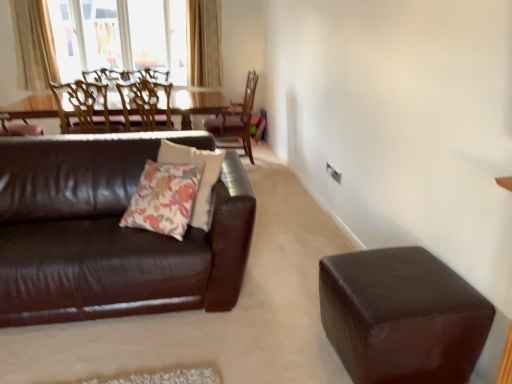
Where is `wooden chair at upper center, placed as the 2th chair when sorted from left to right`? The image size is (512, 384). wooden chair at upper center, placed as the 2th chair when sorted from left to right is located at coordinates (146, 106).

What do you see at coordinates (110, 232) in the screenshot?
I see `shiny brown leather couch at left` at bounding box center [110, 232].

Identify the location of light beige textured curtain at upper center, the 1th curtain when ordered from right to left. (204, 43).

Identify the location of wooden chair at upper left, acting as the third chair starting from the right. (82, 109).

In order to click on wooden chair at upper center, positioned as the 2th chair in right-to-left order in this screenshot , I will do `click(146, 106)`.

Does wooden chair at upper center, positioned as the 2th chair in right-to-left order, have a greater width compared to floral-patterned fabric pillow at center?

Indeed, wooden chair at upper center, positioned as the 2th chair in right-to-left order, has a greater width compared to floral-patterned fabric pillow at center.

Locate an element on the screen. The height and width of the screenshot is (384, 512). throw pillow in front of the wooden chair at upper center, placed as the 2th chair when sorted from left to right is located at coordinates (164, 198).

Which object is further away from the camera taking this photo, wooden chair at upper center, positioned as the 2th chair in right-to-left order, or floral-patterned fabric pillow at center?

wooden chair at upper center, positioned as the 2th chair in right-to-left order.

Which of these two, wooden chair at upper center, placed as the 2th chair when sorted from left to right, or floral-patterned fabric pillow at center, is bigger?

wooden chair at upper center, placed as the 2th chair when sorted from left to right.

Between wooden chair at upper left, acting as the third chair starting from the right, and wooden chair at center, the first chair when ordered from right to left, which one has more height?

With more height is wooden chair at center, the first chair when ordered from right to left.

Is there a large distance between wooden chair at upper left, acting as the third chair starting from the right, and wooden chair at center, which is the third chair in left-to-right order?

That's right, there is a large distance between wooden chair at upper left, acting as the third chair starting from the right, and wooden chair at center, which is the third chair in left-to-right order.

Which point is more distant from viewer, (82,95) or (228,128)?

The point (228,128) is behind.

Is wooden chair at upper left, the 1th chair positioned from the left, inside the boundaries of wooden chair at center, which is the third chair in left-to-right order, or outside?

The correct answer is: outside.

Can you tell me how much light beige textured curtain at upper center, the 1th curtain when ordered from right to left, and wooden chair at upper center, positioned as the 2th chair in right-to-left order, differ in facing direction?

They differ by 178 degrees in their facing directions.

Does light beige textured curtain at upper center, arranged as the second curtain when viewed from the left, have a larger size compared to wooden chair at upper center, placed as the 2th chair when sorted from left to right?

Incorrect, light beige textured curtain at upper center, arranged as the second curtain when viewed from the left, is not larger than wooden chair at upper center, placed as the 2th chair when sorted from left to right.

Considering the positions of point (215, 7) and point (160, 88), is point (215, 7) closer or farther from the camera than point (160, 88)?

Point (215, 7) appears to be farther away from the viewer than point (160, 88).

From a real-world perspective, between light beige textured curtain at upper center, arranged as the second curtain when viewed from the left, and wooden chair at upper center, positioned as the 2th chair in right-to-left order, who is vertically higher?

light beige textured curtain at upper center, arranged as the second curtain when viewed from the left, from a real-world perspective.

Is the position of beige fabric curtain at upper left, marked as the second curtain in a right-to-left arrangement, less distant than that of wooden chair at center, which is the third chair in left-to-right order?

No, it is not.

Is beige fabric curtain at upper left, the first curtain in the left-to-right sequence, inside or outside of wooden chair at center, which is the third chair in left-to-right order?

beige fabric curtain at upper left, the first curtain in the left-to-right sequence, is not enclosed by wooden chair at center, which is the third chair in left-to-right order.

Which of these two, beige fabric curtain at upper left, the first curtain in the left-to-right sequence, or wooden chair at center, which is the third chair in left-to-right order, is smaller?

beige fabric curtain at upper left, the first curtain in the left-to-right sequence.

What's the angular difference between beige fabric curtain at upper left, marked as the second curtain in a right-to-left arrangement, and wooden chair at center, the first chair when ordered from right to left,'s facing directions?

There is a 89.9-degree angle between the facing directions of beige fabric curtain at upper left, marked as the second curtain in a right-to-left arrangement, and wooden chair at center, the first chair when ordered from right to left.

From a real-world perspective, who is located lower, wooden chair at upper left, the 1th chair positioned from the left, or shiny brown leather couch at left?

shiny brown leather couch at left is physically lower.

In terms of width, does wooden chair at upper left, acting as the third chair starting from the right, look wider or thinner when compared to shiny brown leather couch at left?

In the image, wooden chair at upper left, acting as the third chair starting from the right, appears to be more narrow than shiny brown leather couch at left.

Is wooden chair at upper left, acting as the third chair starting from the right, aimed at shiny brown leather couch at left?

No, wooden chair at upper left, acting as the third chair starting from the right, is not oriented towards shiny brown leather couch at left.

Considering the relative positions of wooden chair at upper left, the 1th chair positioned from the left, and shiny brown leather couch at left in the image provided, is wooden chair at upper left, the 1th chair positioned from the left, to the left or to the right of shiny brown leather couch at left?

From the image, it's evident that wooden chair at upper left, the 1th chair positioned from the left, is to the left of shiny brown leather couch at left.

Is point (155, 284) positioned after point (197, 188)?

No.

Does shiny brown leather couch at left come in front of floral-patterned fabric pillow at center?

Yes, shiny brown leather couch at left is in front of floral-patterned fabric pillow at center.

From the image's perspective, is shiny brown leather couch at left beneath floral-patterned fabric pillow at center?

Indeed, from the image's perspective, shiny brown leather couch at left is shown beneath floral-patterned fabric pillow at center.

Is shiny brown leather couch at left taller than floral-patterned fabric pillow at center?

Correct, shiny brown leather couch at left is much taller as floral-patterned fabric pillow at center.

Locate an element on the screen. The height and width of the screenshot is (384, 512). stool below the shiny brown leather couch at left (from the image's perspective) is located at coordinates click(x=402, y=317).

From the picture: Does shiny brown leather couch at left have a greater height compared to shiny brown leather stool at lower right?

Yes, shiny brown leather couch at left is taller than shiny brown leather stool at lower right.

From the picture: In terms of size, does shiny brown leather couch at left appear bigger or smaller than shiny brown leather stool at lower right?

shiny brown leather couch at left is bigger than shiny brown leather stool at lower right.

Consider the image. Is shiny brown leather couch at left inside or outside of shiny brown leather stool at lower right?

shiny brown leather couch at left is not inside shiny brown leather stool at lower right, it's outside.

Locate an element on the screen. The width and height of the screenshot is (512, 384). throw pillow that appears below the wooden chair at upper center, placed as the 2th chair when sorted from left to right (from the image's perspective) is located at coordinates pos(164,198).

Starting from the wooden chair at center, which is the third chair in left-to-right order, which chair is the 2nd one in front? Please provide its 2D coordinates.

[(82, 109)]

Consider the image. Considering their positions, is wooden chair at upper left, acting as the third chair starting from the right, positioned closer to wooden chair at upper center, positioned as the 2th chair in right-to-left order, than shiny brown leather couch at left?

wooden chair at upper left, acting as the third chair starting from the right, is closer to wooden chair at upper center, positioned as the 2th chair in right-to-left order.

From the image, which object appears to be nearer to wooden chair at center, which is the third chair in left-to-right order, beige fabric curtain at upper left, marked as the second curtain in a right-to-left arrangement, or shiny brown leather couch at left?

Among the two, beige fabric curtain at upper left, marked as the second curtain in a right-to-left arrangement, is located nearer to wooden chair at center, which is the third chair in left-to-right order.

From the image, which object appears to be farther from shiny brown leather couch at left, floral-patterned fabric pillow at center or wooden chair at upper center, placed as the 2th chair when sorted from left to right?

The object further to shiny brown leather couch at left is wooden chair at upper center, placed as the 2th chair when sorted from left to right.

Estimate the real-world distances between objects in this image. Which object is further from wooden chair at upper center, positioned as the 2th chair in right-to-left order, wooden chair at upper left, acting as the third chair starting from the right, or floral-patterned fabric pillow at center?

floral-patterned fabric pillow at center is positioned further to the anchor wooden chair at upper center, positioned as the 2th chair in right-to-left order.

Which object lies further to the anchor point shiny brown leather stool at lower right, wooden chair at center, the first chair when ordered from right to left, or beige fabric curtain at upper left, the first curtain in the left-to-right sequence?

beige fabric curtain at upper left, the first curtain in the left-to-right sequence, is positioned further to the anchor shiny brown leather stool at lower right.

Which object lies nearer to the anchor point floral-patterned fabric pillow at center, wooden chair at upper left, the 1th chair positioned from the left, or shiny brown leather couch at left?

shiny brown leather couch at left is closer to floral-patterned fabric pillow at center.

Which object lies further to the anchor point floral-patterned fabric pillow at center, shiny brown leather couch at left or wooden chair at upper left, the 1th chair positioned from the left?

wooden chair at upper left, the 1th chair positioned from the left.

Based on their spatial positions, is wooden chair at upper center, placed as the 2th chair when sorted from left to right, or wooden chair at center, which is the third chair in left-to-right order, further from floral-patterned fabric pillow at center?

Based on the image, wooden chair at center, which is the third chair in left-to-right order, appears to be further to floral-patterned fabric pillow at center.

At what (x,y) coordinates should I click in order to perform the action: click on throw pillow between shiny brown leather stool at lower right and light beige textured curtain at upper center, arranged as the second curtain when viewed from the left, along the z-axis. Please return your answer as a coordinate pair (x, y). Looking at the image, I should click on tap(164, 198).

Where is `throw pillow positioned between shiny brown leather couch at left and wooden chair at upper left, the 1th chair positioned from the left, from near to far`? throw pillow positioned between shiny brown leather couch at left and wooden chair at upper left, the 1th chair positioned from the left, from near to far is located at coordinates (164, 198).

Identify the location of throw pillow located between shiny brown leather couch at left and wooden chair at center, which is the third chair in left-to-right order, in the depth direction. (164, 198).

At what (x,y) coordinates should I click in order to perform the action: click on throw pillow between shiny brown leather stool at lower right and wooden chair at center, which is the third chair in left-to-right order, from front to back. Please return your answer as a coordinate pair (x, y). Image resolution: width=512 pixels, height=384 pixels. Looking at the image, I should click on (164, 198).